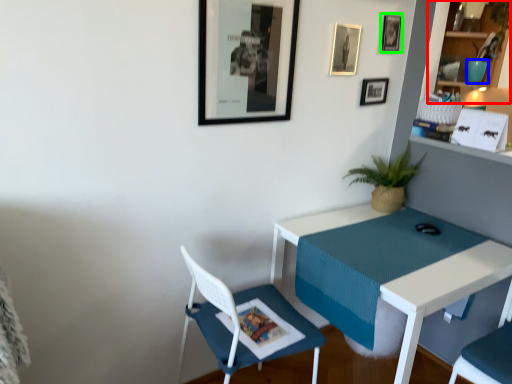
Question: Estimate the real-world distances between objects in this image. Which object is farther from shelf (highlighted by a red box), teal (highlighted by a blue box) or picture frame (highlighted by a green box)?

Choices:
 (A) teal
 (B) picture frame

Answer: (B)